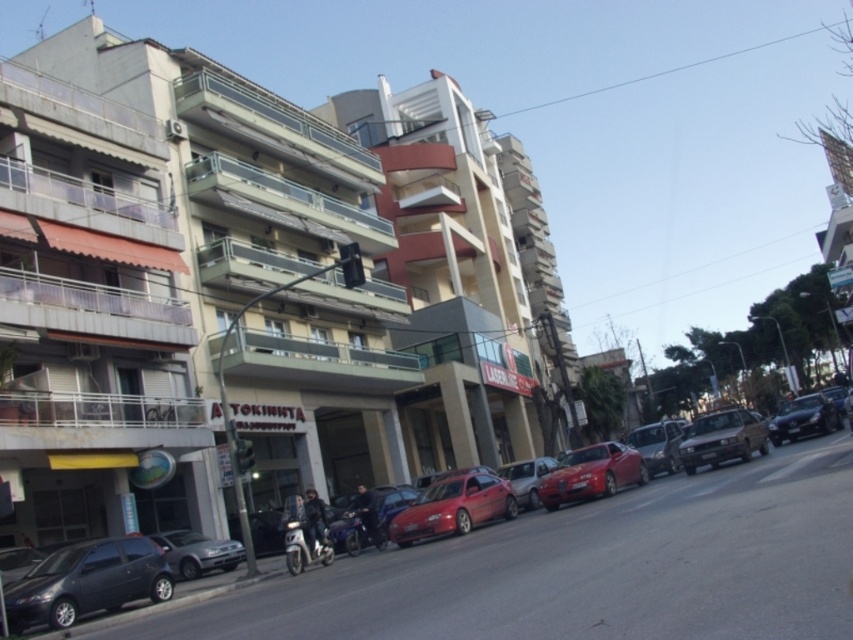
Question: Which point appears farthest from the camera in this image?

Choices:
 (A) (796, 428)
 (B) (462, 508)
 (C) (15, 630)
 (D) (357, 532)

Answer: (A)

Question: Is matte black car at lower left closer to camera compared to silver metallic sedan at lower left?

Choices:
 (A) yes
 (B) no

Answer: (A)

Question: Which of the following is the farthest from the observer?

Choices:
 (A) shiny red car at center
 (B) matte silver sedan at center
 (C) glossy red car at center

Answer: (B)

Question: Is metallic silver sedan at center further to camera compared to shiny red car at center?

Choices:
 (A) no
 (B) yes

Answer: (A)

Question: Does glossy red car at center have a lesser width compared to metallic silver motorcycle at center?

Choices:
 (A) no
 (B) yes

Answer: (B)

Question: Considering the real-world distances, which object is farthest from the matte silver sedan at center?

Choices:
 (A) metallic silver motorcycle at center
 (B) silver metallic sedan at lower left
 (C) shiny red car at center

Answer: (B)